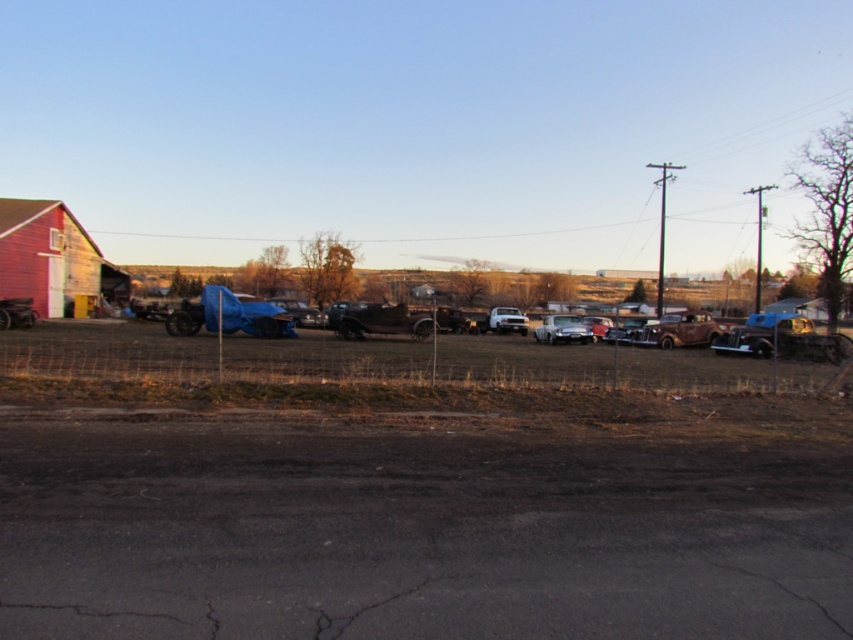
Describe the element at coordinates (51, 257) in the screenshot. This screenshot has width=853, height=640. I see `red wooden barn at left` at that location.

Locate an element on the screen. The height and width of the screenshot is (640, 853). red wooden barn at left is located at coordinates (51, 257).

How much distance is there between black asphalt at lower center and metallic silver truck at center?

black asphalt at lower center is 38.87 meters away from metallic silver truck at center.

Does black asphalt at lower center appear on the right side of metallic silver truck at center?

No, black asphalt at lower center is not to the right of metallic silver truck at center.

What do you see at coordinates (416, 534) in the screenshot?
I see `black asphalt at lower center` at bounding box center [416, 534].

At what (x,y) coordinates should I click in order to perform the action: click on black asphalt at lower center. Please return your answer as a coordinate pair (x, y). Looking at the image, I should click on (416, 534).

Which is behind, point (67, 244) or point (514, 326)?

The point (514, 326) is more distant.

Can you confirm if red wooden barn at left is positioned to the right of metallic silver truck at center?

Incorrect, red wooden barn at left is not on the right side of metallic silver truck at center.

What do you see at coordinates (51, 257) in the screenshot? I see `red wooden barn at left` at bounding box center [51, 257].

I want to click on red wooden barn at left, so click(51, 257).